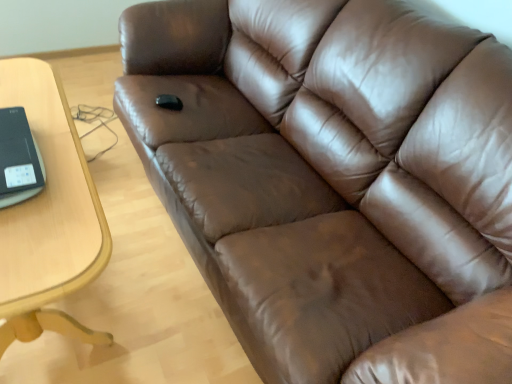
You are a GUI agent. You are given a task and a screenshot of the screen. Output one action in this format:
    pyautogui.click(x=<x>, y=<y>)
    Task: Click on the free space above light wood table at left (from a real-world perspective)
    This screenshot has height=384, width=512.
    Given the screenshot: What is the action you would take?
    pyautogui.click(x=37, y=135)